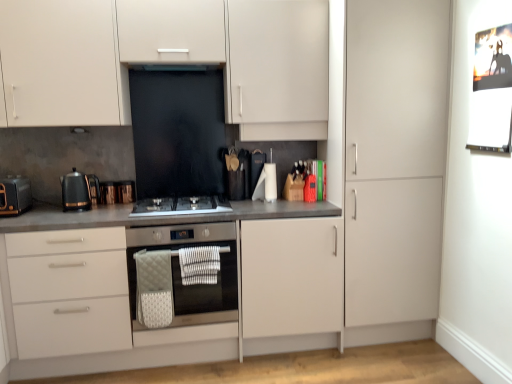
Question: From the image's perspective, is black glass exhaust hood at upper center located above matte gray countertop at center?

Choices:
 (A) yes
 (B) no

Answer: (A)

Question: Can you confirm if black glass exhaust hood at upper center is wider than matte gray countertop at center?

Choices:
 (A) no
 (B) yes

Answer: (A)

Question: Is black glass exhaust hood at upper center surrounding matte gray countertop at center?

Choices:
 (A) yes
 (B) no

Answer: (B)

Question: Could you tell me if black glass exhaust hood at upper center is turned towards matte gray countertop at center?

Choices:
 (A) yes
 (B) no

Answer: (B)

Question: Is black glass exhaust hood at upper center smaller than matte gray countertop at center?

Choices:
 (A) no
 (B) yes

Answer: (B)

Question: Looking at their shapes, would you say copper metallic toaster at left, the 1th appliance viewed from the left, is wider or thinner than stainless steel oven at center?

Choices:
 (A) wide
 (B) thin

Answer: (B)

Question: Is point (102, 190) positioned closer to the camera than point (185, 324)?

Choices:
 (A) farther
 (B) closer

Answer: (A)

Question: Do you think copper metallic toaster at left, the 2th appliance viewed from the right, is within stainless steel oven at center, or outside of it?

Choices:
 (A) inside
 (B) outside

Answer: (B)

Question: Looking at the image, does copper metallic toaster at left, the 1th appliance viewed from the left, seem bigger or smaller compared to stainless steel oven at center?

Choices:
 (A) small
 (B) big

Answer: (A)

Question: Looking at the image, does black glass gas stove at center seem bigger or smaller compared to stainless steel oven at center?

Choices:
 (A) small
 (B) big

Answer: (A)

Question: Is black glass gas stove at center spatially inside stainless steel oven at center, or outside of it?

Choices:
 (A) outside
 (B) inside

Answer: (A)

Question: In terms of height, does black glass gas stove at center look taller or shorter compared to stainless steel oven at center?

Choices:
 (A) short
 (B) tall

Answer: (A)

Question: Based on their positions, is black glass gas stove at center located to the left or right of stainless steel oven at center?

Choices:
 (A) right
 (B) left

Answer: (B)

Question: In the image, is matte black toaster at left, the first kitchen appliance when ordered from left to right, positioned in front of or behind black glass exhaust hood at upper center?

Choices:
 (A) behind
 (B) front

Answer: (B)

Question: Is matte black toaster at left, arranged as the second kitchen appliance when viewed from the right, spatially inside black glass exhaust hood at upper center, or outside of it?

Choices:
 (A) inside
 (B) outside

Answer: (B)